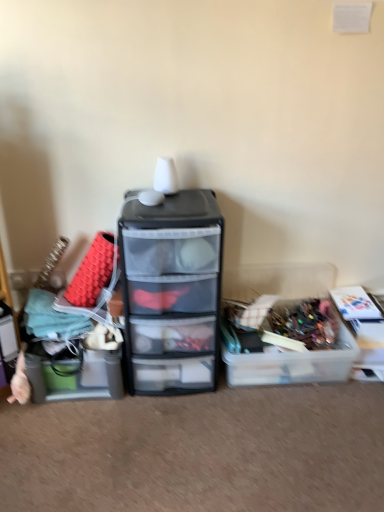
What is the approximate height of translucent plastic container at center-right, which is counted as the second storage box, starting from the right?

The height of translucent plastic container at center-right, which is counted as the second storage box, starting from the right, is 8.31 inches.

Identify the location of translucent plastic storage box at left, acting as the 1th storage box starting from the left. (76, 377).

At what (x,y) coordinates should I click in order to perform the action: click on clear plastic storage box at right, which is the 1th storage box in right-to-left order. Please return your answer as a coordinate pair (x, y). Looking at the image, I should click on (363, 329).

Locate an element on the screen. The image size is (384, 512). translucent plastic container at center-right, acting as the second storage box starting from the left is located at coordinates (292, 358).

From the image's perspective, which one is positioned lower, translucent plastic container at center-right, acting as the second storage box starting from the left, or clear plastic storage box at right, which is the 3th storage box in left-to-right order?

translucent plastic container at center-right, acting as the second storage box starting from the left, from the image's perspective.

Between translucent plastic container at center-right, which is counted as the second storage box, starting from the right, and clear plastic storage box at right, which is the 1th storage box in right-to-left order, which one has smaller size?

clear plastic storage box at right, which is the 1th storage box in right-to-left order.

Is the depth of translucent plastic container at center-right, acting as the second storage box starting from the left, less than that of clear plastic storage box at right, which is the 3th storage box in left-to-right order?

Yes, it is in front of clear plastic storage box at right, which is the 3th storage box in left-to-right order.

Which is behind, point (318, 362) or point (350, 306)?

Point (350, 306)

Which of these two, clear plastic storage box at right, which is the 1th storage box in right-to-left order, or translucent plastic container at center-right, which is counted as the second storage box, starting from the right, is bigger?

translucent plastic container at center-right, which is counted as the second storage box, starting from the right, is bigger.

Is point (382, 349) farther from viewer compared to point (288, 355)?

Yes, it is.

Could you tell me if clear plastic storage box at right, which is the 3th storage box in left-to-right order, is facing translucent plastic container at center-right, which is counted as the second storage box, starting from the right?

No, clear plastic storage box at right, which is the 3th storage box in left-to-right order, does not turn towards translucent plastic container at center-right, which is counted as the second storage box, starting from the right.

Is clear plastic storage box at right, which is the 1th storage box in right-to-left order, directly adjacent to translucent plastic container at center-right, acting as the second storage box starting from the left?

No, clear plastic storage box at right, which is the 1th storage box in right-to-left order, is not in contact with translucent plastic container at center-right, acting as the second storage box starting from the left.

Is there a large distance between transparent plastic drawers at center and translucent plastic container at center-right, acting as the second storage box starting from the left?

No, transparent plastic drawers at center is not far from translucent plastic container at center-right, acting as the second storage box starting from the left.

Is transparent plastic drawers at center in front of or behind translucent plastic container at center-right, acting as the second storage box starting from the left, in the image?

In the image, transparent plastic drawers at center appears in front of translucent plastic container at center-right, acting as the second storage box starting from the left.

Is transparent plastic drawers at center oriented towards translucent plastic container at center-right, which is counted as the second storage box, starting from the right?

No, transparent plastic drawers at center is not oriented towards translucent plastic container at center-right, which is counted as the second storage box, starting from the right.

From the picture: From the image's perspective, does transparent plastic drawers at center appear lower than translucent plastic container at center-right, which is counted as the second storage box, starting from the right?

No.

Is clear plastic storage box at right, which is the 3th storage box in left-to-right order, bigger than transparent plastic drawers at center?

No.

Considering the positions of objects clear plastic storage box at right, which is the 3th storage box in left-to-right order, and transparent plastic drawers at center in the image provided, who is more to the left, clear plastic storage box at right, which is the 3th storage box in left-to-right order, or transparent plastic drawers at center?

transparent plastic drawers at center is more to the left.

From a real-world perspective, who is located lower, clear plastic storage box at right, which is the 3th storage box in left-to-right order, or transparent plastic drawers at center?

clear plastic storage box at right, which is the 3th storage box in left-to-right order, from a real-world perspective.

Considering the sizes of objects translucent plastic storage box at left, which appears as the 3th storage box when viewed from the right, and translucent plastic container at center-right, acting as the second storage box starting from the left, in the image provided, who is taller, translucent plastic storage box at left, which appears as the 3th storage box when viewed from the right, or translucent plastic container at center-right, acting as the second storage box starting from the left,?

Standing taller between the two is translucent plastic storage box at left, which appears as the 3th storage box when viewed from the right.

In the image, is translucent plastic storage box at left, acting as the 1th storage box starting from the left, on the left side or the right side of translucent plastic container at center-right, acting as the second storage box starting from the left?

In the image, translucent plastic storage box at left, acting as the 1th storage box starting from the left, appears on the left side of translucent plastic container at center-right, acting as the second storage box starting from the left.

Could you measure the distance between translucent plastic storage box at left, acting as the 1th storage box starting from the left, and translucent plastic container at center-right, which is counted as the second storage box, starting from the right?

translucent plastic storage box at left, acting as the 1th storage box starting from the left, and translucent plastic container at center-right, which is counted as the second storage box, starting from the right, are 27.03 inches apart from each other.

From the image's perspective, is translucent plastic storage box at left, acting as the 1th storage box starting from the left, above or below clear plastic storage box at right, which is the 1th storage box in right-to-left order?

translucent plastic storage box at left, acting as the 1th storage box starting from the left, is below clear plastic storage box at right, which is the 1th storage box in right-to-left order.

Can clear plastic storage box at right, which is the 1th storage box in right-to-left order, be found inside translucent plastic storage box at left, which appears as the 3th storage box when viewed from the right?

Actually, clear plastic storage box at right, which is the 1th storage box in right-to-left order, is outside translucent plastic storage box at left, which appears as the 3th storage box when viewed from the right.

Is translucent plastic storage box at left, which appears as the 3th storage box when viewed from the right, directly adjacent to clear plastic storage box at right, which is the 1th storage box in right-to-left order?

No.

Considering the relative sizes of translucent plastic storage box at left, acting as the 1th storage box starting from the left, and clear plastic storage box at right, which is the 1th storage box in right-to-left order, in the image provided, is translucent plastic storage box at left, acting as the 1th storage box starting from the left, thinner than clear plastic storage box at right, which is the 1th storage box in right-to-left order,?

Incorrect, the width of translucent plastic storage box at left, acting as the 1th storage box starting from the left, is not less than that of clear plastic storage box at right, which is the 1th storage box in right-to-left order.

Is translucent plastic storage box at left, which appears as the 3th storage box when viewed from the right, looking in the opposite direction of transparent plastic drawers at center?

translucent plastic storage box at left, which appears as the 3th storage box when viewed from the right, is not turned away from transparent plastic drawers at center.

From a real-world perspective, who is located higher, translucent plastic storage box at left, acting as the 1th storage box starting from the left, or transparent plastic drawers at center?

In real-world perspective, transparent plastic drawers at center is above.

Is translucent plastic storage box at left, acting as the 1th storage box starting from the left, bigger or smaller than transparent plastic drawers at center?

Considering their sizes, translucent plastic storage box at left, acting as the 1th storage box starting from the left, takes up less space than transparent plastic drawers at center.

You are a GUI agent. You are given a task and a screenshot of the screen. Output one action in this format:
    pyautogui.click(x=<x>, y=<y>)
    Task: Click on the storage box that is the 1st object to the left of the clear plastic storage box at right, which is the 3th storage box in left-to-right order, starting at the anchor
    The height and width of the screenshot is (512, 384).
    Given the screenshot: What is the action you would take?
    pyautogui.click(x=292, y=358)

Locate an element on the screen. the 1st storage box in front of the clear plastic storage box at right, which is the 1th storage box in right-to-left order, counting from the anchor's position is located at coordinates (292, 358).

Looking at the image, which one is located closer to clear plastic storage box at right, which is the 1th storage box in right-to-left order, translucent plastic container at center-right, which is counted as the second storage box, starting from the right, or transparent plastic drawers at center?

translucent plastic container at center-right, which is counted as the second storage box, starting from the right, is positioned closer to the anchor clear plastic storage box at right, which is the 1th storage box in right-to-left order.

Estimate the real-world distances between objects in this image. Which object is closer to transparent plastic drawers at center, translucent plastic storage box at left, acting as the 1th storage box starting from the left, or translucent plastic container at center-right, acting as the second storage box starting from the left?

translucent plastic storage box at left, acting as the 1th storage box starting from the left, is closer to transparent plastic drawers at center.

Looking at the image, which one is located further to clear plastic storage box at right, which is the 3th storage box in left-to-right order, translucent plastic container at center-right, acting as the second storage box starting from the left, or translucent plastic storage box at left, acting as the 1th storage box starting from the left?

translucent plastic storage box at left, acting as the 1th storage box starting from the left.

From the image, which object appears to be farther from transparent plastic drawers at center, clear plastic storage box at right, which is the 1th storage box in right-to-left order, or translucent plastic storage box at left, acting as the 1th storage box starting from the left?

The object further to transparent plastic drawers at center is clear plastic storage box at right, which is the 1th storage box in right-to-left order.

Estimate the real-world distances between objects in this image. Which object is further from translucent plastic storage box at left, which appears as the 3th storage box when viewed from the right, translucent plastic container at center-right, acting as the second storage box starting from the left, or transparent plastic drawers at center?

The object further to translucent plastic storage box at left, which appears as the 3th storage box when viewed from the right, is translucent plastic container at center-right, acting as the second storage box starting from the left.

Estimate the real-world distances between objects in this image. Which object is further from transparent plastic drawers at center, clear plastic storage box at right, which is the 1th storage box in right-to-left order, or translucent plastic container at center-right, which is counted as the second storage box, starting from the right?

clear plastic storage box at right, which is the 1th storage box in right-to-left order, is further to transparent plastic drawers at center.

Which object lies nearer to the anchor point clear plastic storage box at right, which is the 1th storage box in right-to-left order, translucent plastic storage box at left, acting as the 1th storage box starting from the left, or transparent plastic drawers at center?

transparent plastic drawers at center lies closer to clear plastic storage box at right, which is the 1th storage box in right-to-left order, than the other object.

From the image, which object appears to be nearer to translucent plastic container at center-right, acting as the second storage box starting from the left, transparent plastic drawers at center or translucent plastic storage box at left, acting as the 1th storage box starting from the left?

Among the two, transparent plastic drawers at center is located nearer to translucent plastic container at center-right, acting as the second storage box starting from the left.

You are a GUI agent. You are given a task and a screenshot of the screen. Output one action in this format:
    pyautogui.click(x=<x>, y=<y>)
    Task: Click on the storage box situated between transparent plastic drawers at center and clear plastic storage box at right, which is the 3th storage box in left-to-right order, from left to right
    The height and width of the screenshot is (512, 384).
    Given the screenshot: What is the action you would take?
    pyautogui.click(x=292, y=358)

At what (x,y) coordinates should I click in order to perform the action: click on furniture between translucent plastic storage box at left, acting as the 1th storage box starting from the left, and clear plastic storage box at right, which is the 3th storage box in left-to-right order, from left to right. Please return your answer as a coordinate pair (x, y). Looking at the image, I should click on (172, 291).

This screenshot has height=512, width=384. I want to click on furniture between translucent plastic storage box at left, acting as the 1th storage box starting from the left, and translucent plastic container at center-right, which is counted as the second storage box, starting from the right, so click(x=172, y=291).

Locate an element on the screen. storage box between translucent plastic storage box at left, acting as the 1th storage box starting from the left, and clear plastic storage box at right, which is the 3th storage box in left-to-right order, from left to right is located at coordinates (292, 358).